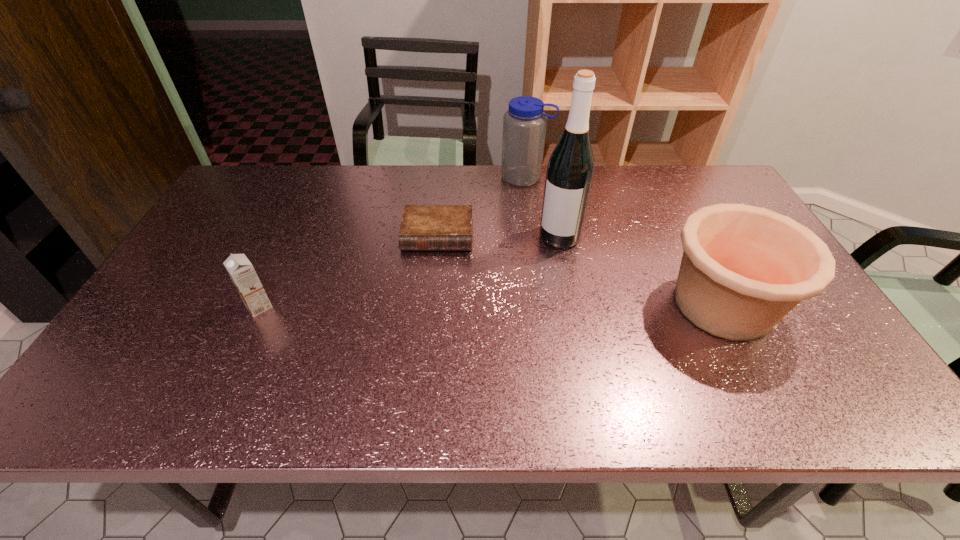
Locate an element on the screen. the second closest object to the third shortest object is located at coordinates (524, 125).

This screenshot has height=540, width=960. I want to click on vacant point that satisfies the following two spatial constraints: 1. on the back side of the rightmost object; 2. on the right side of the leftmost object, so click(260, 305).